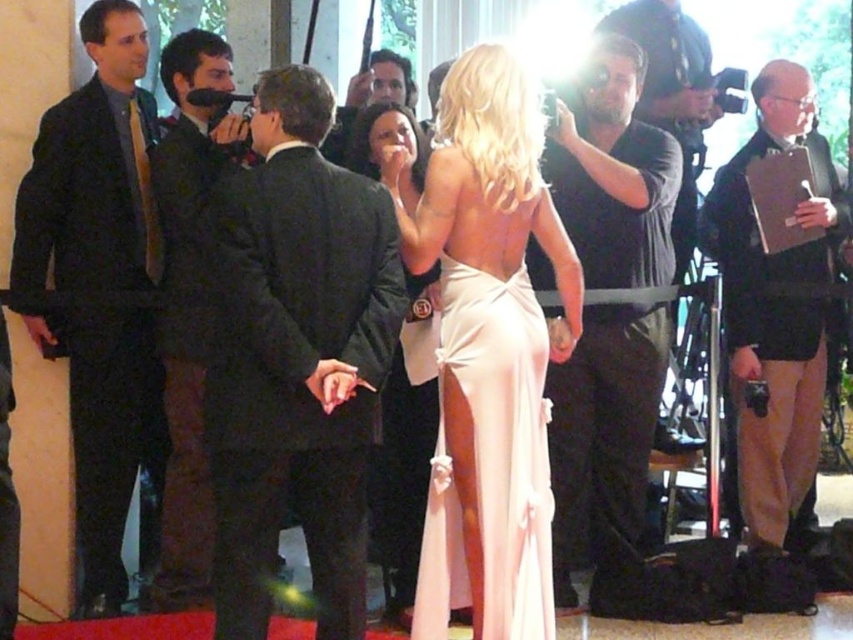
Is point (807, 460) more distant than point (387, 566)?

Yes.

Can you confirm if light brown leather jacket at right is bigger than satin beige dress at center?

Correct, light brown leather jacket at right is larger in size than satin beige dress at center.

Is point (775, 259) farther from viewer compared to point (395, 428)?

Yes, point (775, 259) is behind point (395, 428).

This screenshot has height=640, width=853. Find the location of `light brown leather jacket at right`. light brown leather jacket at right is located at coordinates (776, 308).

Consider the image. Who is positioned more to the right, satin pink dress at center or satin pale pink dress at center?

Positioned to the right is satin pink dress at center.

Can you confirm if satin pink dress at center is positioned to the left of satin pale pink dress at center?

Incorrect, satin pink dress at center is not on the left side of satin pale pink dress at center.

At what (x,y) coordinates should I click in order to perform the action: click on satin pink dress at center. Please return your answer as a coordinate pair (x, y). This screenshot has width=853, height=640. Looking at the image, I should click on (488, 349).

From the picture: Which is above, matte black camera at right or satin pale pink dress at center?

Positioned higher is matte black camera at right.

Does matte black camera at right have a lesser height compared to satin pale pink dress at center?

In fact, matte black camera at right may be taller than satin pale pink dress at center.

Between point (669, 152) and point (485, 330), which one is positioned behind?

Point (669, 152)

What are the coordinates of `matte black camera at right` in the screenshot? It's located at (613, 172).